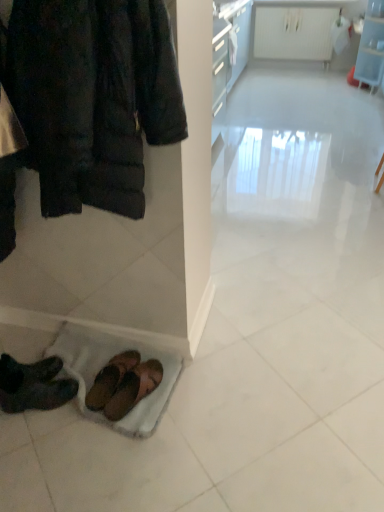
What are the coordinates of `dark brown quilted jacket at upper left` in the screenshot? It's located at [x=91, y=97].

Describe the element at coordinates (33, 385) in the screenshot. Image resolution: width=384 pixels, height=512 pixels. I see `dark brown leather shoes at lower left, the first footwear positioned from the left` at that location.

Describe the element at coordinates (111, 379) in the screenshot. The width and height of the screenshot is (384, 512). I see `brown suede sandals at lower center, which ranks as the second footwear in left-to-right order` at that location.

Where is `brown suede sandals at lower center, which is counted as the 2th footwear, starting from the right`? brown suede sandals at lower center, which is counted as the 2th footwear, starting from the right is located at coordinates (111, 379).

Where is `dark brown quilted jacket at upper left`? This screenshot has width=384, height=512. dark brown quilted jacket at upper left is located at coordinates (91, 97).

From a real-world perspective, is dark brown leather shoes at lower left, the 3th footwear when ordered from right to left, located higher than brown leather sandals at lower left, the 3th footwear from the left?

Indeed, from a real-world perspective, dark brown leather shoes at lower left, the 3th footwear when ordered from right to left, stands above brown leather sandals at lower left, the 3th footwear from the left.

Is the surface of dark brown leather shoes at lower left, the 3th footwear when ordered from right to left, in direct contact with brown leather sandals at lower left, the first footwear viewed from the right?

No, dark brown leather shoes at lower left, the 3th footwear when ordered from right to left, is not touching brown leather sandals at lower left, the first footwear viewed from the right.

How many degrees apart are the facing directions of dark brown leather shoes at lower left, the 3th footwear when ordered from right to left, and brown leather sandals at lower left, the 3th footwear from the left?

The angular difference between dark brown leather shoes at lower left, the 3th footwear when ordered from right to left, and brown leather sandals at lower left, the 3th footwear from the left, is 26.4 degrees.

This screenshot has height=512, width=384. Find the location of `footwear located in front of the brown leather sandals at lower left, the 3th footwear from the left`. footwear located in front of the brown leather sandals at lower left, the 3th footwear from the left is located at coordinates (33, 385).

Which is correct: brown suede sandals at lower center, which is counted as the 2th footwear, starting from the right, is inside brown leather sandals at lower left, the first footwear viewed from the right, or outside of it?

brown suede sandals at lower center, which is counted as the 2th footwear, starting from the right, lies outside brown leather sandals at lower left, the first footwear viewed from the right.

Is brown suede sandals at lower center, which ranks as the second footwear in left-to-right order, positioned with its back to brown leather sandals at lower left, the first footwear viewed from the right?

No, brown leather sandals at lower left, the first footwear viewed from the right, is not at the back of brown suede sandals at lower center, which ranks as the second footwear in left-to-right order.

Can you tell me how much brown suede sandals at lower center, which is counted as the 2th footwear, starting from the right, and brown leather sandals at lower left, the first footwear viewed from the right, differ in facing direction?

The angle between the facing direction of brown suede sandals at lower center, which is counted as the 2th footwear, starting from the right, and the facing direction of brown leather sandals at lower left, the first footwear viewed from the right, is 10.2 degrees.

Considering the sizes of objects brown suede sandals at lower center, which is counted as the 2th footwear, starting from the right, and brown leather sandals at lower left, the 3th footwear from the left, in the image provided, who is taller, brown suede sandals at lower center, which is counted as the 2th footwear, starting from the right, or brown leather sandals at lower left, the 3th footwear from the left,?

With more height is brown suede sandals at lower center, which is counted as the 2th footwear, starting from the right.

Considering the relative positions of brown suede sandals at lower center, which ranks as the second footwear in left-to-right order, and dark brown leather shoes at lower left, the first footwear positioned from the left, in the image provided, is brown suede sandals at lower center, which ranks as the second footwear in left-to-right order, to the left of dark brown leather shoes at lower left, the first footwear positioned from the left, from the viewer's perspective?

In fact, brown suede sandals at lower center, which ranks as the second footwear in left-to-right order, is to the right of dark brown leather shoes at lower left, the first footwear positioned from the left.

From the image's perspective, who appears lower, brown suede sandals at lower center, which is counted as the 2th footwear, starting from the right, or dark brown leather shoes at lower left, the 3th footwear when ordered from right to left?

From the image's view, dark brown leather shoes at lower left, the 3th footwear when ordered from right to left, is below.

Locate an element on the screen. The width and height of the screenshot is (384, 512). footwear lying on the left of brown suede sandals at lower center, which is counted as the 2th footwear, starting from the right is located at coordinates (33, 385).

Between brown suede sandals at lower center, which is counted as the 2th footwear, starting from the right, and dark brown leather shoes at lower left, the first footwear positioned from the left, which one has less height?

brown suede sandals at lower center, which is counted as the 2th footwear, starting from the right, is shorter.

Is brown leather sandals at lower left, the 3th footwear from the left, turned away from brown suede sandals at lower center, which is counted as the 2th footwear, starting from the right?

No.

From a real-world perspective, is brown leather sandals at lower left, the 3th footwear from the left, positioned over brown suede sandals at lower center, which is counted as the 2th footwear, starting from the right, based on gravity?

Actually, brown leather sandals at lower left, the 3th footwear from the left, is physically below brown suede sandals at lower center, which is counted as the 2th footwear, starting from the right, in the real world.

Which object is closer to the camera, brown leather sandals at lower left, the first footwear viewed from the right, or brown suede sandals at lower center, which ranks as the second footwear in left-to-right order?

brown leather sandals at lower left, the first footwear viewed from the right.

From the picture: From the image's perspective, is brown suede sandals at lower center, which ranks as the second footwear in left-to-right order, located beneath clear plastic shelf at upper right, which ranks as the 1th shelf in right-to-left order?

Correct, brown suede sandals at lower center, which ranks as the second footwear in left-to-right order, appears lower than clear plastic shelf at upper right, which ranks as the 1th shelf in right-to-left order, in the image.

From the image's perspective, starting from the brown suede sandals at lower center, which is counted as the 2th footwear, starting from the right, which shelf is the 1st one above? Please provide its 2D coordinates.

[(371, 52)]

Based on the photo, can clear plastic shelf at upper right, placed as the second shelf when sorted from left to right, be found inside brown suede sandals at lower center, which is counted as the 2th footwear, starting from the right?

No, clear plastic shelf at upper right, placed as the second shelf when sorted from left to right, is not inside brown suede sandals at lower center, which is counted as the 2th footwear, starting from the right.

Who is bigger, brown suede sandals at lower center, which ranks as the second footwear in left-to-right order, or clear plastic shelf at upper right, which ranks as the 1th shelf in right-to-left order?

clear plastic shelf at upper right, which ranks as the 1th shelf in right-to-left order.

Is dark brown leather shoes at lower left, the 3th footwear when ordered from right to left, positioned before clear plastic shelf at upper right, placed as the second shelf when sorted from left to right?

Yes, the depth of dark brown leather shoes at lower left, the 3th footwear when ordered from right to left, is less than that of clear plastic shelf at upper right, placed as the second shelf when sorted from left to right.

From the image's perspective, which one is positioned lower, dark brown leather shoes at lower left, the 3th footwear when ordered from right to left, or clear plastic shelf at upper right, which ranks as the 1th shelf in right-to-left order?

dark brown leather shoes at lower left, the 3th footwear when ordered from right to left, is shown below in the image.

Does dark brown leather shoes at lower left, the first footwear positioned from the left, turn towards clear plastic shelf at upper right, placed as the second shelf when sorted from left to right?

No.

From a real-world perspective, is white glossy radiator at upper center, the first shelf positioned from the left, under brown suede sandals at lower center, which ranks as the second footwear in left-to-right order?

No, from a real-world perspective, white glossy radiator at upper center, the first shelf positioned from the left, is not under brown suede sandals at lower center, which ranks as the second footwear in left-to-right order.

Between white glossy radiator at upper center, the first shelf positioned from the left, and brown suede sandals at lower center, which is counted as the 2th footwear, starting from the right, which one has smaller width?

white glossy radiator at upper center, the first shelf positioned from the left.

I want to click on the 2nd footwear counting from the left side of the brown leather sandals at lower left, the 3th footwear from the left, so click(33, 385).

Locate an element on the screen. Image resolution: width=384 pixels, height=512 pixels. footwear that is the 2nd one when counting downward from the brown suede sandals at lower center, which ranks as the second footwear in left-to-right order (from the image's perspective) is located at coordinates (134, 388).

From the image, which object appears to be nearer to dark brown leather shoes at lower left, the 3th footwear when ordered from right to left, clear plastic shelf at upper right, which ranks as the 1th shelf in right-to-left order, or white glossy radiator at upper center, the first shelf positioned from the left?

clear plastic shelf at upper right, which ranks as the 1th shelf in right-to-left order, lies closer to dark brown leather shoes at lower left, the 3th footwear when ordered from right to left, than the other object.

Considering their positions, is brown leather sandals at lower left, the 3th footwear from the left, positioned closer to dark brown leather shoes at lower left, the 3th footwear when ordered from right to left, than dark brown quilted jacket at upper left?

The object closer to dark brown leather shoes at lower left, the 3th footwear when ordered from right to left, is brown leather sandals at lower left, the 3th footwear from the left.

From the image, which object appears to be nearer to dark brown quilted jacket at upper left, clear plastic shelf at upper right, placed as the second shelf when sorted from left to right, or brown leather sandals at lower left, the 3th footwear from the left?

brown leather sandals at lower left, the 3th footwear from the left, is closer to dark brown quilted jacket at upper left.

Looking at the image, which one is located further to brown suede sandals at lower center, which is counted as the 2th footwear, starting from the right, clear plastic shelf at upper right, which ranks as the 1th shelf in right-to-left order, or dark brown leather shoes at lower left, the first footwear positioned from the left?

Based on the image, clear plastic shelf at upper right, which ranks as the 1th shelf in right-to-left order, appears to be further to brown suede sandals at lower center, which is counted as the 2th footwear, starting from the right.

Looking at the image, which one is located closer to brown suede sandals at lower center, which ranks as the second footwear in left-to-right order, clear plastic shelf at upper right, which ranks as the 1th shelf in right-to-left order, or white glossy radiator at upper center, the second shelf from the right?

clear plastic shelf at upper right, which ranks as the 1th shelf in right-to-left order.

When comparing their distances from clear plastic shelf at upper right, which ranks as the 1th shelf in right-to-left order, does brown suede sandals at lower center, which is counted as the 2th footwear, starting from the right, or dark brown quilted jacket at upper left seem further?

brown suede sandals at lower center, which is counted as the 2th footwear, starting from the right, lies further to clear plastic shelf at upper right, which ranks as the 1th shelf in right-to-left order, than the other object.

Considering their positions, is brown leather sandals at lower left, the 3th footwear from the left, positioned further to dark brown leather shoes at lower left, the 3th footwear when ordered from right to left, than clear plastic shelf at upper right, which ranks as the 1th shelf in right-to-left order?

Based on the image, clear plastic shelf at upper right, which ranks as the 1th shelf in right-to-left order, appears to be further to dark brown leather shoes at lower left, the 3th footwear when ordered from right to left.

From the image, which object appears to be nearer to dark brown leather shoes at lower left, the 3th footwear when ordered from right to left, dark brown quilted jacket at upper left or brown leather sandals at lower left, the 3th footwear from the left?

The object closer to dark brown leather shoes at lower left, the 3th footwear when ordered from right to left, is brown leather sandals at lower left, the 3th footwear from the left.

Where is `footwear between dark brown quilted jacket at upper left and dark brown leather shoes at lower left, the 3th footwear when ordered from right to left, vertically`? The width and height of the screenshot is (384, 512). footwear between dark brown quilted jacket at upper left and dark brown leather shoes at lower left, the 3th footwear when ordered from right to left, vertically is located at coordinates (111, 379).

At what (x,y) coordinates should I click in order to perform the action: click on shelf between brown suede sandals at lower center, which ranks as the second footwear in left-to-right order, and white glossy radiator at upper center, the second shelf from the right, from front to back. Please return your answer as a coordinate pair (x, y). Looking at the image, I should click on (371, 52).

Locate an element on the screen. This screenshot has width=384, height=512. footwear between clear plastic shelf at upper right, placed as the second shelf when sorted from left to right, and dark brown leather shoes at lower left, the first footwear positioned from the left, in the up-down direction is located at coordinates (111, 379).

I want to click on footwear located between brown leather sandals at lower left, the first footwear viewed from the right, and white glossy radiator at upper center, the first shelf positioned from the left, in the depth direction, so click(x=111, y=379).